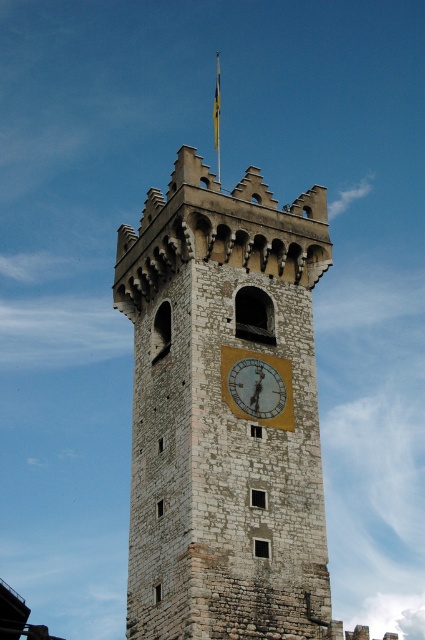
You are an architect examining the stone clock tower at center and the gold metallic clock at center. Which object is wider?

The stone clock tower at center is wider than the gold metallic clock at center.

You are standing at the base of the stone clock tower at center and want to place a new flagpole on top of the existing one. The new flagpole is 1.5 meters long. Can you attach it to the existing flagpole without exceeding the maximum height limit of 42 meters?

The stone clock tower at center and the flagpole are 41.13 meters apart. Adding a 1.5 meter flagpole would exceed the 42 meter limit, so it cannot be attached.

You are standing at the base of the stone clock tower at center and want to reach the yellow fabric flag at top. What do you need to do first?

The stone clock tower at center is much taller than the yellow fabric flag at top, so you need to climb the tower to reach the yellow fabric flag at top.